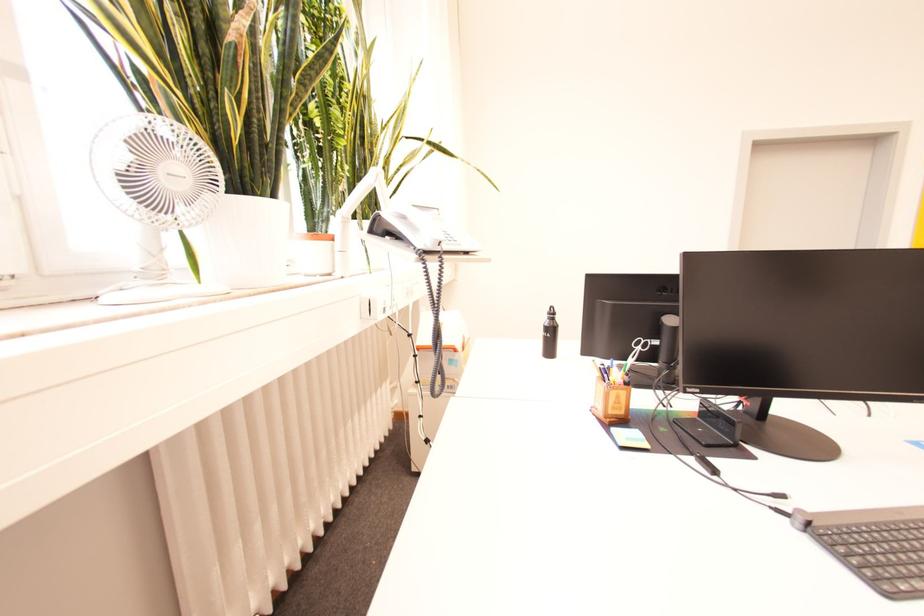
The height and width of the screenshot is (616, 924). Find the location of `cabinet drawer handle`. cabinet drawer handle is located at coordinates (368, 307).